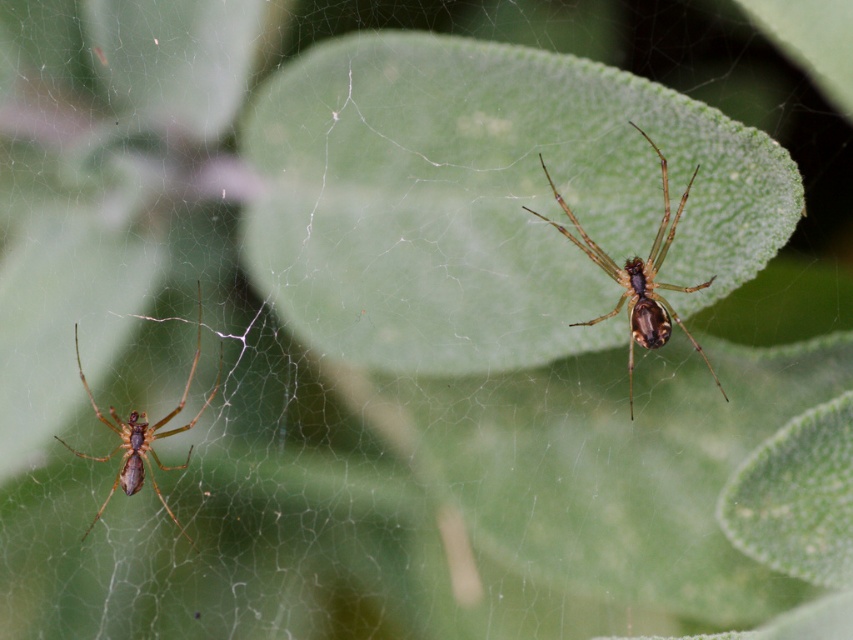
You are an entomologist observing two spiders in a web. You see the brown fuzzy spider at upper right and the brown fuzzy spider at left. Which spider is positioned to the right side of the other?

The brown fuzzy spider at upper right is positioned to the right of the brown fuzzy spider at left.

You are a scientist measuring the distance between two brown fuzzy spiders in a web. The web is located in a garden where the minimum distance between any two spiders must be at least 2 meters for safety. Are the two brown fuzzy spider at upper right meeting the safety requirement?

The two brown fuzzy spider at upper right are 1.89 meters apart, which is less than the required 2 meters, so they do not meet the safety requirement.

You are standing 2 meters away from a point marked at coordinates point (682,288). You want to place a small spider model exactly at that point. If the spider model is 2 centimeters in length, will it fit without overlapping any other parts of the web?

The point (682,288) is 1.99 meters away from the viewer, which is approximately 2 meters. The spider model is 2 centimeters long, so it should fit at that point without overlapping other web parts, as the distance allows sufficient space.